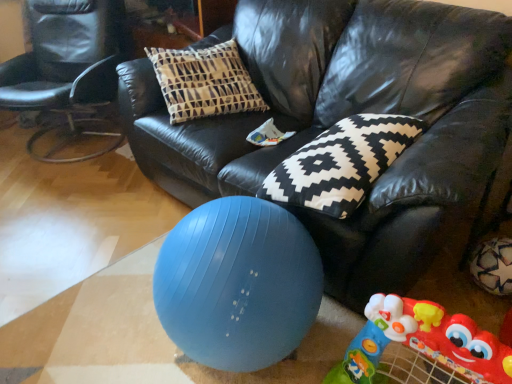
Question: Does blue rubber ball at lower center have a larger size compared to black leather chair at left?

Choices:
 (A) yes
 (B) no

Answer: (B)

Question: Does blue rubber ball at lower center have a lesser height compared to black leather chair at left?

Choices:
 (A) no
 (B) yes

Answer: (B)

Question: Is the depth of blue rubber ball at lower center greater than that of black leather chair at left?

Choices:
 (A) no
 (B) yes

Answer: (A)

Question: Considering the relative sizes of blue rubber ball at lower center and black leather chair at left in the image provided, is blue rubber ball at lower center thinner than black leather chair at left?

Choices:
 (A) yes
 (B) no

Answer: (A)

Question: Is blue rubber ball at lower center at the left side of black leather chair at left?

Choices:
 (A) yes
 (B) no

Answer: (B)

Question: Is rubberized plastic walker at lower right wider or thinner than black leather couch at center?

Choices:
 (A) wide
 (B) thin

Answer: (B)

Question: Considering the relative positions of rubberized plastic walker at lower right and black leather couch at center in the image provided, is rubberized plastic walker at lower right to the left or to the right of black leather couch at center?

Choices:
 (A) left
 (B) right

Answer: (B)

Question: From the image's perspective, is rubberized plastic walker at lower right positioned above or below black leather couch at center?

Choices:
 (A) below
 (B) above

Answer: (A)

Question: Is rubberized plastic walker at lower right taller or shorter than black leather couch at center?

Choices:
 (A) short
 (B) tall

Answer: (A)

Question: From the image's perspective, is blue rubber ball at lower center above or below black leather couch at center?

Choices:
 (A) above
 (B) below

Answer: (B)

Question: In terms of height, does blue rubber ball at lower center look taller or shorter compared to black leather couch at center?

Choices:
 (A) tall
 (B) short

Answer: (B)

Question: Considering the positions of blue rubber ball at lower center and black leather couch at center in the image, is blue rubber ball at lower center wider or thinner than black leather couch at center?

Choices:
 (A) thin
 (B) wide

Answer: (A)

Question: Does point (170, 304) appear closer or farther from the camera than point (380, 51)?

Choices:
 (A) farther
 (B) closer

Answer: (B)

Question: Is black leather chair at left inside the boundaries of black leather couch at center, or outside?

Choices:
 (A) outside
 (B) inside

Answer: (A)

Question: Would you say black leather chair at left is to the left or to the right of black leather couch at center in the picture?

Choices:
 (A) left
 (B) right

Answer: (A)